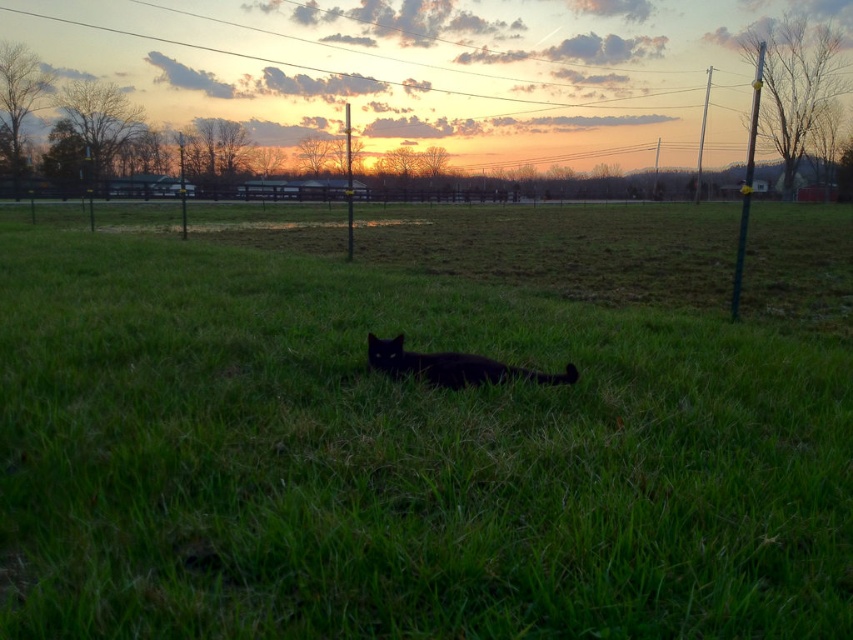
Is the position of green grass at center less distant than that of black matte cat at center?

Yes, green grass at center is in front of black matte cat at center.

Which is behind, point (219, 332) or point (436, 358)?

Point (219, 332)

You are a GUI agent. You are given a task and a screenshot of the screen. Output one action in this format:
    pyautogui.click(x=<x>, y=<y>)
    Task: Click on the green grass at center
    
    Given the screenshot: What is the action you would take?
    pyautogui.click(x=424, y=424)